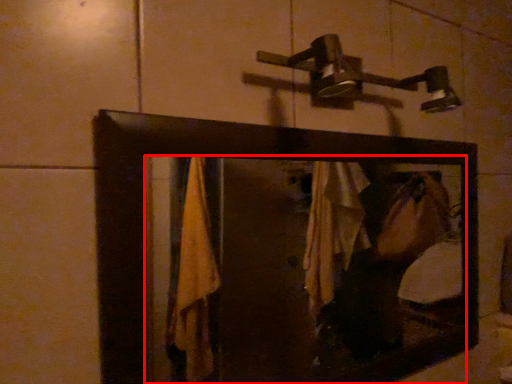
Question: From the image, what is the correct spatial relationship of mirror (annotated by the red box) in relation to shower?

Choices:
 (A) left
 (B) right

Answer: (A)